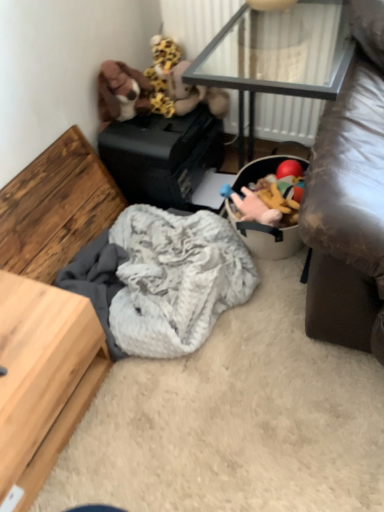
Question: Does transparent glass table at upper center lie behind fuzzy fabric stuffed animal at upper center, arranged as the third toy when viewed from the right?

Choices:
 (A) yes
 (B) no

Answer: (B)

Question: Is transparent glass table at upper center surrounding fuzzy fabric stuffed animal at upper center, arranged as the third toy when viewed from the right?

Choices:
 (A) yes
 (B) no

Answer: (B)

Question: From a real-world perspective, does transparent glass table at upper center stand above fuzzy fabric stuffed animal at upper center, arranged as the third toy when viewed from the right?

Choices:
 (A) no
 (B) yes

Answer: (B)

Question: From a real-world perspective, is transparent glass table at upper center physically below fuzzy fabric stuffed animal at upper center, which appears as the 3th toy when viewed from the left?

Choices:
 (A) yes
 (B) no

Answer: (B)

Question: Would you say transparent glass table at upper center is outside fuzzy fabric stuffed animal at upper center, arranged as the third toy when viewed from the right?

Choices:
 (A) yes
 (B) no

Answer: (A)

Question: Is fluffy yellow and brown stuffed animal at upper center, the fourth toy viewed from the right, taller or shorter than brown plush toy at upper left, the fifth toy from the right?

Choices:
 (A) short
 (B) tall

Answer: (B)

Question: Is fluffy yellow and brown stuffed animal at upper center, the fourth toy viewed from the right, situated inside brown plush toy at upper left, the fifth toy from the right, or outside?

Choices:
 (A) outside
 (B) inside

Answer: (A)

Question: From a real-world perspective, is fluffy yellow and brown stuffed animal at upper center, the fourth toy viewed from the right, physically located above or below brown plush toy at upper left, arranged as the 1th toy when viewed from the left?

Choices:
 (A) above
 (B) below

Answer: (B)

Question: Considering the relative positions of fluffy yellow and brown stuffed animal at upper center, the second toy when ordered from left to right, and brown plush toy at upper left, arranged as the 1th toy when viewed from the left, in the image provided, is fluffy yellow and brown stuffed animal at upper center, the second toy when ordered from left to right, to the left or to the right of brown plush toy at upper left, arranged as the 1th toy when viewed from the left,?

Choices:
 (A) left
 (B) right

Answer: (B)

Question: From a real-world perspective, is fluffy yellow and brown stuffed animal at upper center, the fourth toy viewed from the right, above or below soft plush toys at center?

Choices:
 (A) below
 (B) above

Answer: (B)

Question: Is point (153, 59) positioned closer to the camera than point (241, 177)?

Choices:
 (A) farther
 (B) closer

Answer: (B)

Question: Is fluffy yellow and brown stuffed animal at upper center, the fourth toy viewed from the right, inside the boundaries of soft plush toys at center, or outside?

Choices:
 (A) outside
 (B) inside

Answer: (A)

Question: In the image, is fluffy yellow and brown stuffed animal at upper center, the second toy when ordered from left to right, on the left side or the right side of soft plush toys at center?

Choices:
 (A) right
 (B) left

Answer: (B)

Question: In the image, is transparent glass table at upper center positioned in front of or behind soft plush toy at center, the 4th toy from the left?

Choices:
 (A) behind
 (B) front

Answer: (B)

Question: Looking at the image, does transparent glass table at upper center seem bigger or smaller compared to soft plush toy at center, the 4th toy from the left?

Choices:
 (A) small
 (B) big

Answer: (B)